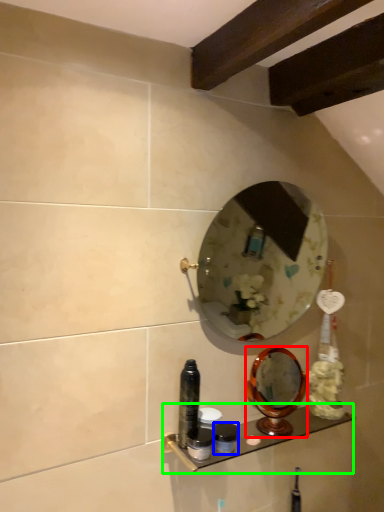
Question: Based on their relative distances, which object is nearer to mirror (highlighted by a red box)? Choose from toiletry (highlighted by a blue box) and shelf (highlighted by a green box).

Choices:
 (A) toiletry
 (B) shelf

Answer: (B)